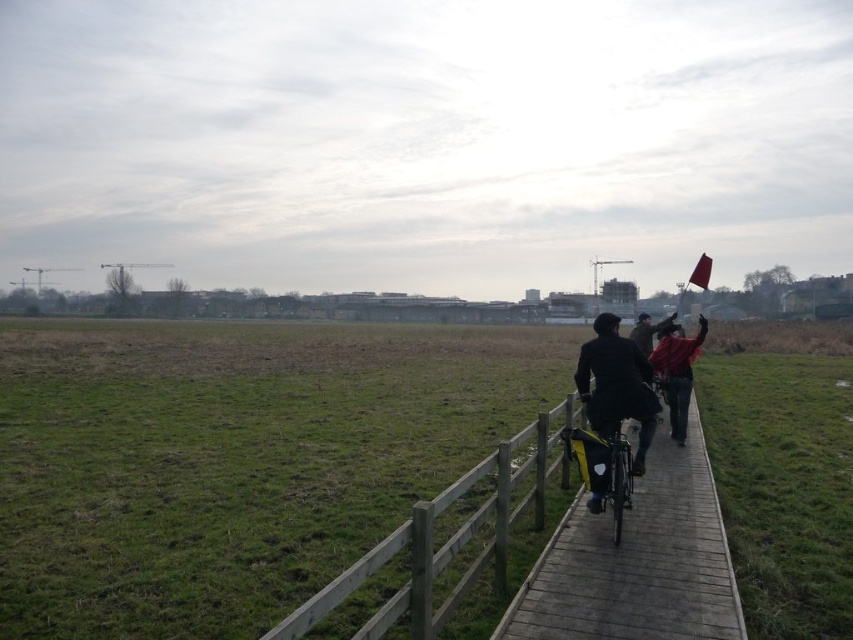
You are standing on the wooden pathway and notice the green grass at lower left and the dark blue jacket at center. Which object is positioned to the left of the other?

The green grass at lower left is to the left of the dark blue jacket at center.

You are planning to place a small garden ornament that requires a space of 0.5 square meters. Based on the scene, which area would be suitable between the green grass at lower left and the red fabric flag at right?

The green grass at lower left is larger in size than the red fabric flag at right, so the green grass at lower left would be suitable for placing the garden ornament as it has enough space.

You are planning to place a small garden bench in the scene. The bench requires a space wider than the red fabric flag at right. Based on the scene, can the green grass at lower left accommodate the bench?

The green grass at lower left has a larger width than the red fabric flag at right, so it can accommodate the bench.